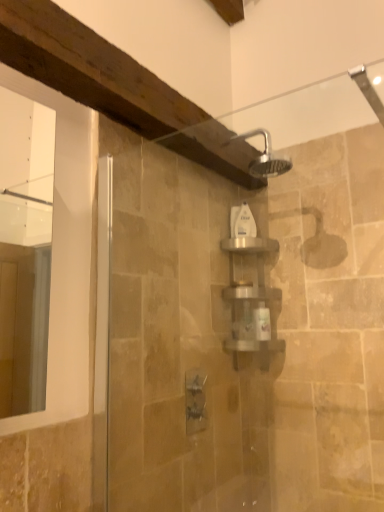
Question: From the image's perspective, is satin silver shelf at center located above or below white plastic bottle at center?

Choices:
 (A) above
 (B) below

Answer: (B)

Question: From a real-world perspective, is satin silver shelf at center physically located above or below white plastic bottle at center?

Choices:
 (A) below
 (B) above

Answer: (A)

Question: In the image, is satin silver shelf at center on the left side or the right side of white plastic bottle at center?

Choices:
 (A) right
 (B) left

Answer: (A)

Question: Looking at the image, does white plastic bottle at center seem bigger or smaller compared to satin silver shelf at center?

Choices:
 (A) big
 (B) small

Answer: (B)

Question: Choose the correct answer: Is white plastic bottle at center inside satin silver shelf at center or outside it?

Choices:
 (A) inside
 (B) outside

Answer: (B)

Question: Is point (241, 212) positioned closer to the camera than point (261, 347)?

Choices:
 (A) farther
 (B) closer

Answer: (A)

Question: From the image's perspective, relative to satin silver shelf at center, is white plastic bottle at center above or below?

Choices:
 (A) below
 (B) above

Answer: (B)